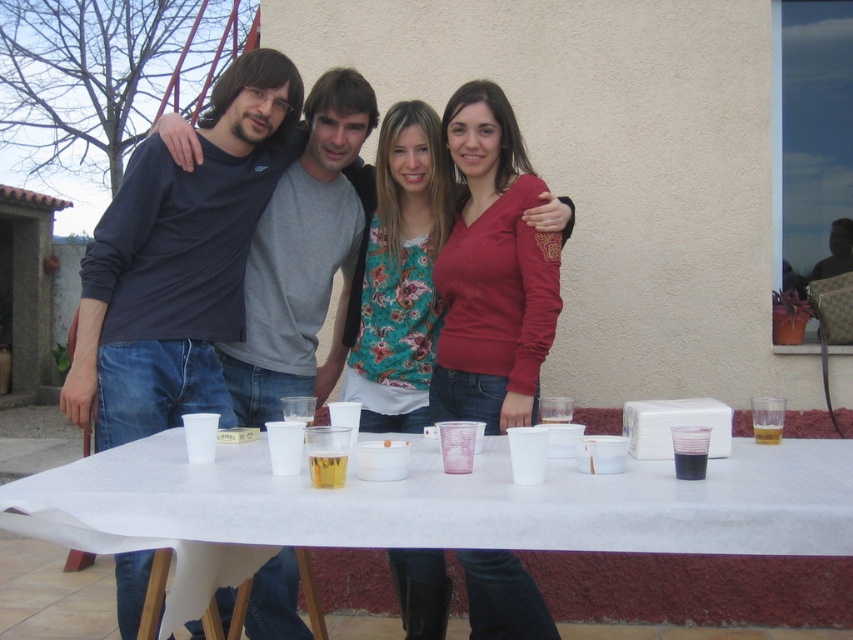
Question: Does floral fabric shirt at center have a lesser width compared to translucent plastic cup at center?

Choices:
 (A) no
 (B) yes

Answer: (A)

Question: Which point is farther from the camera taking this photo?

Choices:
 (A) (132, 189)
 (B) (689, 456)

Answer: (A)

Question: Which object is the farthest from the clear plastic cup at center?

Choices:
 (A) white plastic table at center
 (B) translucent plastic cup at center
 (C) floral fabric shirt at center
 (D) matte black shirt at left

Answer: (D)

Question: Is the position of matte black shirt at left more distant than that of clear plastic cup at center?

Choices:
 (A) no
 (B) yes

Answer: (B)

Question: Does matte black shirt at left appear over translucent plastic cup at center?

Choices:
 (A) no
 (B) yes

Answer: (B)

Question: Which point appears farthest from the camera in this image?

Choices:
 (A) (691, 467)
 (B) (244, 500)
 (C) (399, 164)

Answer: (C)